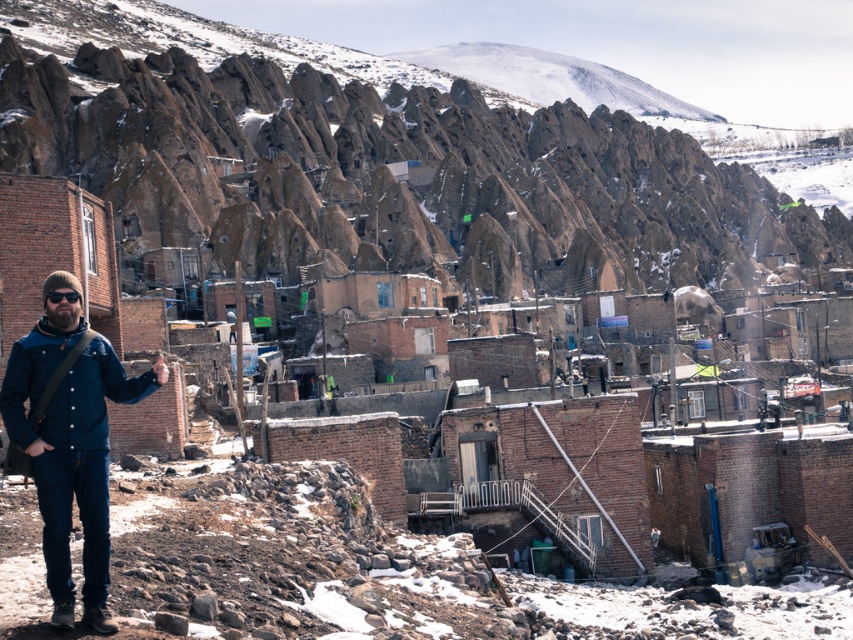
Who is higher up, brown rocky mountain at upper center or blue denim jacket at lower left?

brown rocky mountain at upper center is above.

Does brown rocky mountain at upper center come in front of blue denim jacket at lower left?

No, brown rocky mountain at upper center is behind blue denim jacket at lower left.

Who is more forward, (480, 113) or (65, 394)?

Positioned in front is point (65, 394).

Image resolution: width=853 pixels, height=640 pixels. What are the coordinates of `brown rocky mountain at upper center` in the screenshot? It's located at (376, 157).